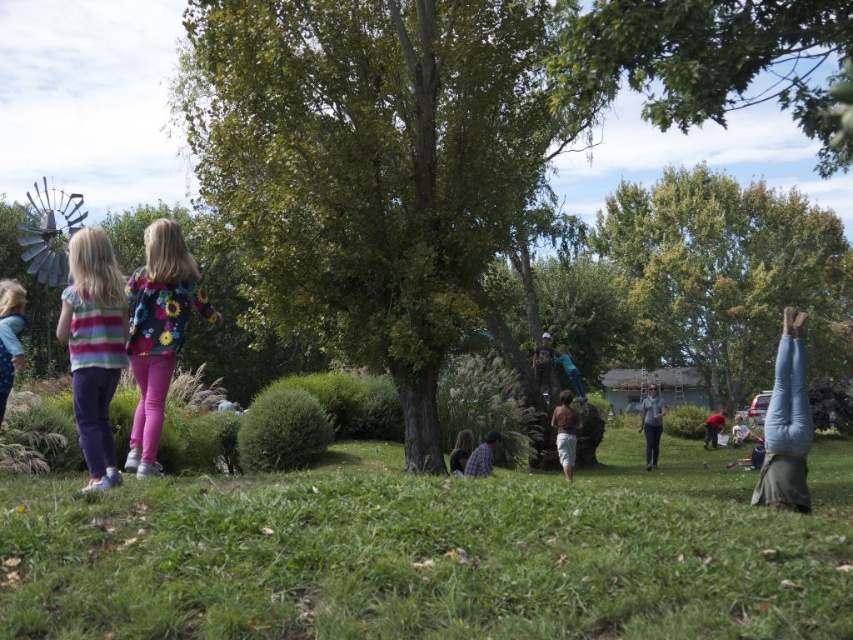
You are a photographer trying to capture a shot of the green grassy at lower center and denim jeans at center. Since you want to focus on the grass, which object should you position closer to the front of your camera frame?

The green grassy at lower center is in front of denim jeans at center, so to focus on the grass, position the green grassy at lower center closer to the front of your camera frame.

You are a photographer trying to capture a photo of the floral shirt at center and the jeans at lower right. Based on their positions, which object should you focus on first if you want to include both in your shot without moving the camera?

The floral shirt at center is to the left of the jeans at lower right, so you should focus on the floral shirt at center first to ensure both are in frame.